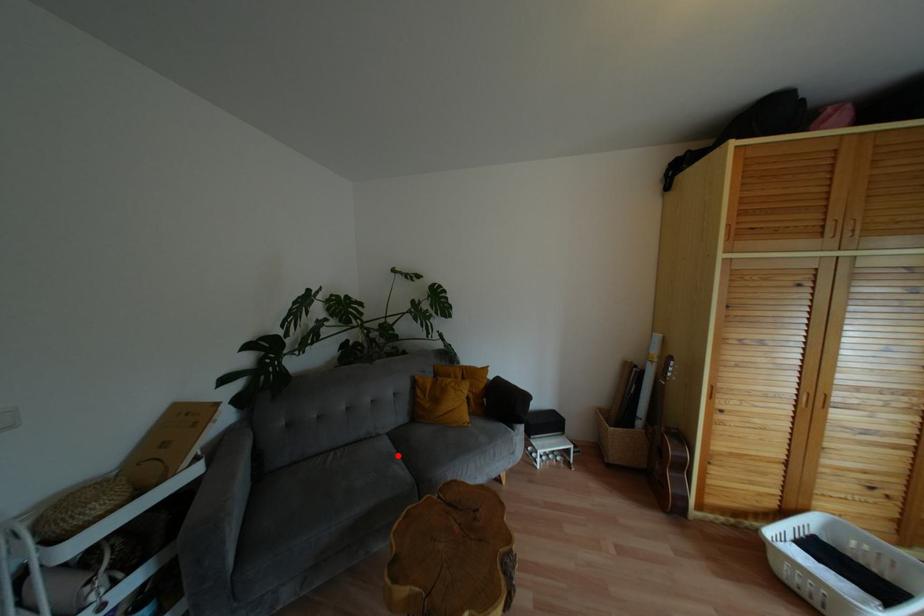
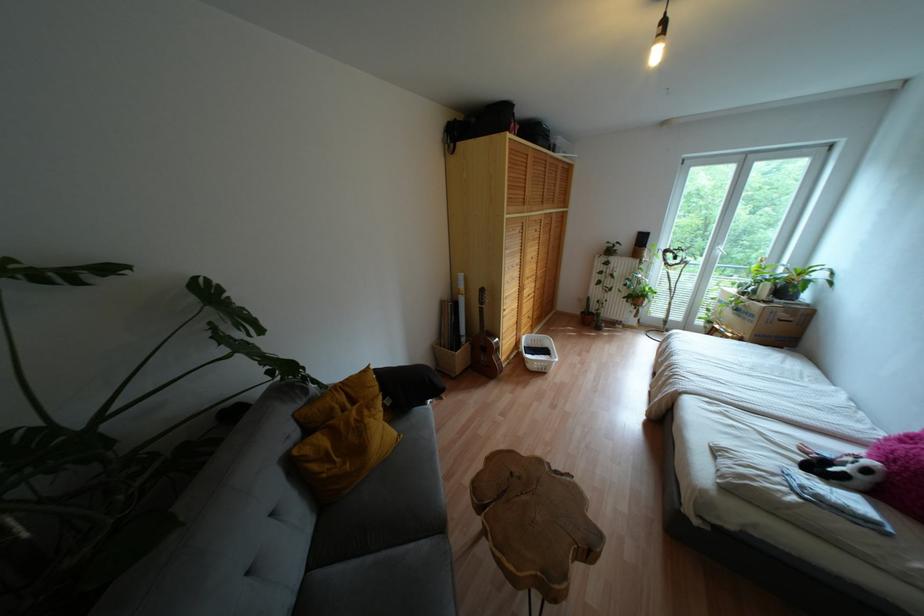
Question: I am providing you with two images of the same scene from different viewpoints. A red point is marked on the first image. Is the red point's position out of view in image 2?

Choices:
 (A) Yes
 (B) No

Answer: (B)